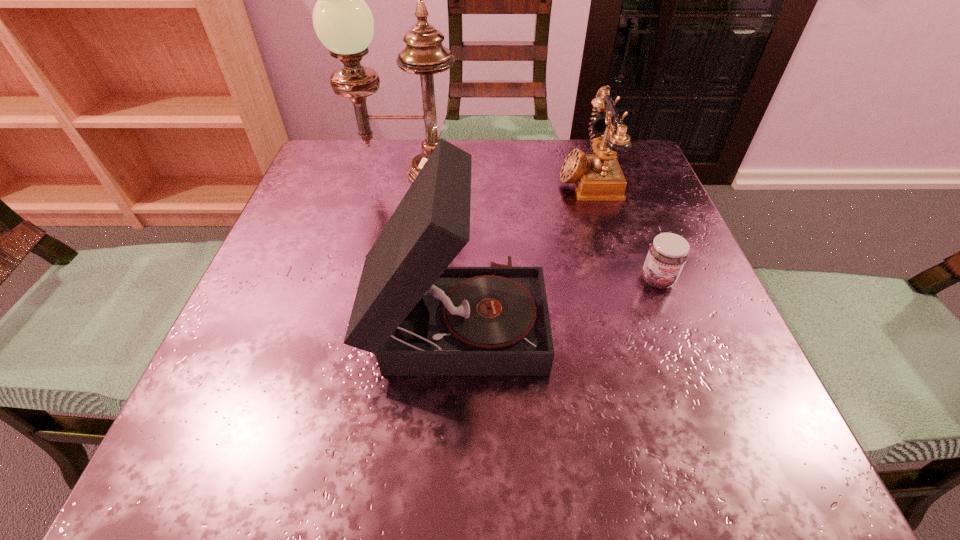
Find the location of a particular element. free location at the right edge is located at coordinates (654, 343).

Image resolution: width=960 pixels, height=540 pixels. I want to click on free space at the far left corner of the desktop, so click(333, 189).

Where is `free space at the far right corner of the desktop`? free space at the far right corner of the desktop is located at coordinates (636, 139).

Where is `vacant position at the near right corner of the desktop`? Image resolution: width=960 pixels, height=540 pixels. vacant position at the near right corner of the desktop is located at coordinates (712, 476).

Identify the location of empty space that is in between the oil lamp and the jam. (532, 227).

Where is `vacant area between the telephone and the oil lamp`? vacant area between the telephone and the oil lamp is located at coordinates (496, 176).

Identify the location of empty location between the third shortest object and the jam. (557, 299).

Find the location of a particular element. Image resolution: width=960 pixels, height=540 pixels. free space between the telephone and the jam is located at coordinates (622, 228).

You are a GUI agent. You are given a task and a screenshot of the screen. Output one action in this format:
    pyautogui.click(x=<x>, y=<y>)
    Task: Click on the free space between the third shortest object and the telephone
    
    Given the screenshot: What is the action you would take?
    pyautogui.click(x=521, y=247)

Locate an element on the screen. The width and height of the screenshot is (960, 540). free point between the jam and the third shortest object is located at coordinates (557, 299).